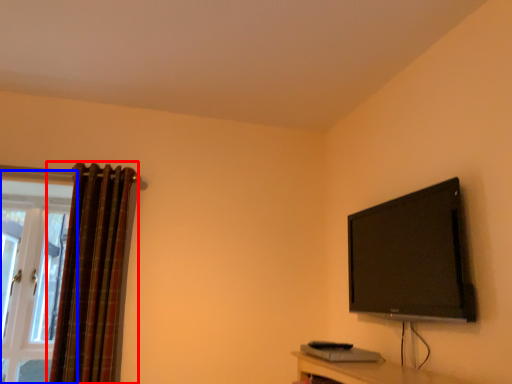
Question: Which of the following is the farthest to the observer, curtain (highlighted by a red box) or window (highlighted by a blue box)?

Choices:
 (A) curtain
 (B) window

Answer: (B)